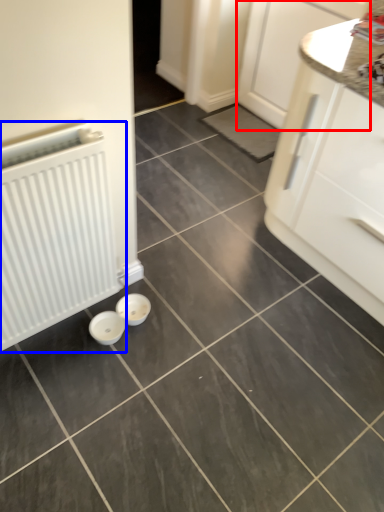
Question: Which object appears closest to the camera in this image, cabinetry (highlighted by a red box) or radiator (highlighted by a blue box)?

Choices:
 (A) cabinetry
 (B) radiator

Answer: (B)